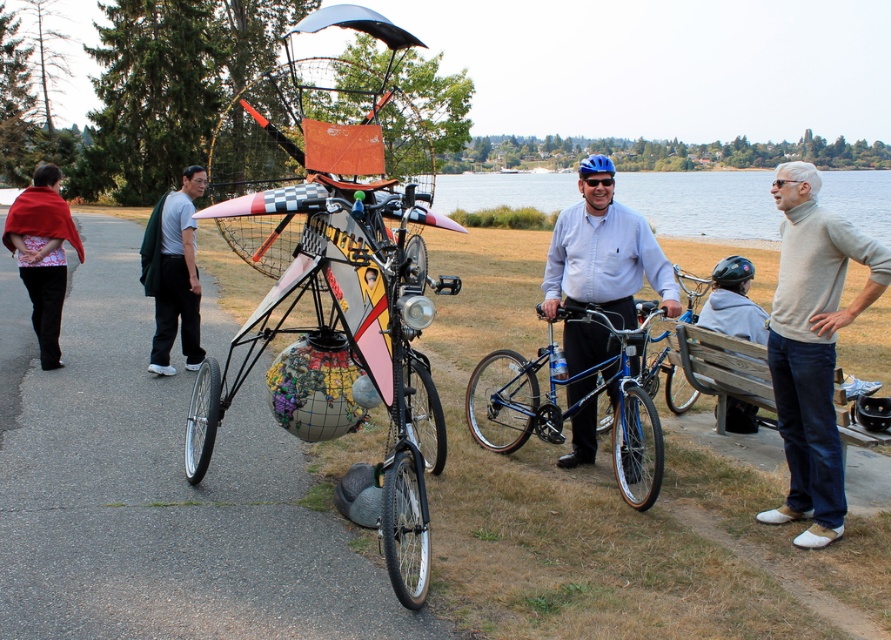
What do you see at coordinates (164, 497) in the screenshot? This screenshot has width=891, height=640. I see `metallic bicycle at center` at bounding box center [164, 497].

The width and height of the screenshot is (891, 640). I want to click on metallic bicycle at center, so click(164, 497).

Does green fabric backpack at left appear under gray fleece jacket at lower right?

No.

Which is more to the right, green fabric backpack at left or gray fleece jacket at lower right?

gray fleece jacket at lower right

Does point (166, 204) come farther from viewer compared to point (725, 294)?

Yes, it is.

At what (x,y) coordinates should I click in order to perform the action: click on green fabric backpack at left. Please return your answer as a coordinate pair (x, y). The width and height of the screenshot is (891, 640). Looking at the image, I should click on [x=178, y=276].

Is point (526, 397) positioned in front of point (162, 289)?

Yes, point (526, 397) is closer to viewer.

Can you confirm if shiny blue bicycle at center is smaller than green fabric backpack at left?

No.

Is point (651, 504) positioned in front of point (170, 202)?

Yes.

Where is `shiny blue bicycle at center`? shiny blue bicycle at center is located at coordinates (573, 404).